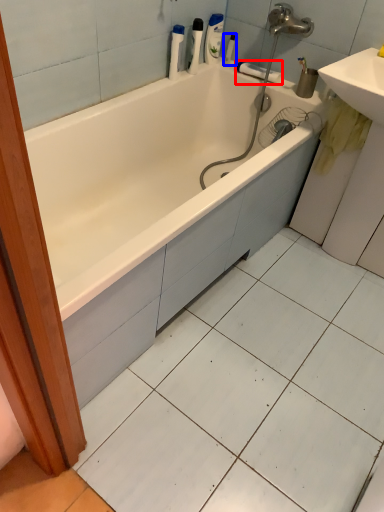
Question: Which object appears farthest to the camera in this image, towel bar (highlighted by a red box) or toiletry (highlighted by a blue box)?

Choices:
 (A) towel bar
 (B) toiletry

Answer: (B)